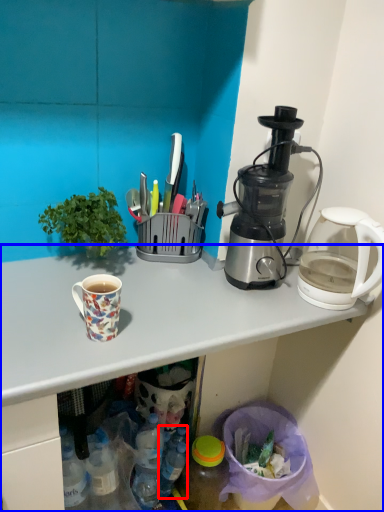
Question: Which object is further to the camera taking this photo, bottle (highlighted by a red box) or desk (highlighted by a blue box)?

Choices:
 (A) bottle
 (B) desk

Answer: (A)